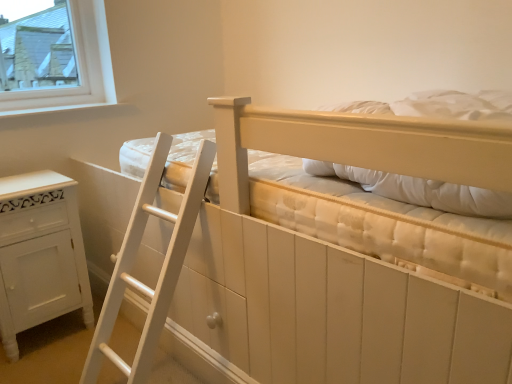
Identify the location of white painted wood cabinet at lower left. This screenshot has width=512, height=384. (40, 254).

This screenshot has width=512, height=384. What do you see at coordinates (393, 221) in the screenshot?
I see `matte white bunk bed at center` at bounding box center [393, 221].

In order to click on white painted wood cabinet at lower left in this screenshot , I will do `click(40, 254)`.

Between matte white bunk bed at center and white wood at upper left, which one has larger size?

matte white bunk bed at center.

From a real-world perspective, between matte white bunk bed at center and white wood at upper left, who is vertically higher?

white wood at upper left.

What's the angular difference between matte white bunk bed at center and white wood at upper left's facing directions?

They differ by 179 degrees in their facing directions.

Based on the photo, from the image's perspective, who appears lower, matte white bunk bed at center or white wood at upper left?

matte white bunk bed at center appears lower in the image.

Looking at this image, which point is more forward, [36,112] or [139,300]?

The point [139,300] is in front.

Is white wood at upper left aimed at white wood drawer at lower center?

No, white wood at upper left is not facing towards white wood drawer at lower center.

Which of these two, white wood at upper left or white wood drawer at lower center, stands shorter?

With less height is white wood at upper left.

Does white wood at upper left have a greater width compared to white wood drawer at lower center?

Indeed, white wood at upper left has a greater width compared to white wood drawer at lower center.

Is white wood at upper left facing towards matte white bunk bed at center?

Yes, white wood at upper left faces towards matte white bunk bed at center.

Does point (3, 114) lie behind point (300, 229)?

Yes.

From a real-world perspective, is white wood at upper left physically located above or below matte white bunk bed at center?

Clearly, from a real-world perspective, white wood at upper left is above matte white bunk bed at center.

Identify the location of window sill above the matte white bunk bed at center (from a real-world perspective). (54, 109).

From a real-world perspective, does white quilted pillow at upper right stand above white wood at upper left?

No, from a real-world perspective, white quilted pillow at upper right is not above white wood at upper left.

Considering the relative sizes of white quilted pillow at upper right and white wood at upper left in the image provided, is white quilted pillow at upper right bigger than white wood at upper left?

Correct, white quilted pillow at upper right is larger in size than white wood at upper left.

From the picture: Can we say white quilted pillow at upper right lies outside white wood at upper left?

A: white quilted pillow at upper right lies outside white wood at upper left's area.

Considering the relative positions of white quilted pillow at upper right and white wood at upper left in the image provided, is white quilted pillow at upper right to the left or to the right of white wood at upper left?

From the image, it's evident that white quilted pillow at upper right is to the right of white wood at upper left.

Is white quilted pillow at upper right turned away from white painted wood cabinet at lower left?

white quilted pillow at upper right does not have its back to white painted wood cabinet at lower left.

Between white quilted pillow at upper right and white painted wood cabinet at lower left, which one has less height?

With less height is white quilted pillow at upper right.

Is white quilted pillow at upper right wider or thinner than white painted wood cabinet at lower left?

Clearly, white quilted pillow at upper right has more width compared to white painted wood cabinet at lower left.

Does matte white bunk bed at center contain white quilted pillow at upper right?

Yes, white quilted pillow at upper right is a part of matte white bunk bed at center.

From the image's perspective, is matte white bunk bed at center above white quilted pillow at upper right?

Incorrect, from the image's perspective, matte white bunk bed at center is lower than white quilted pillow at upper right.

Which of these two, matte white bunk bed at center or white quilted pillow at upper right, stands shorter?

white quilted pillow at upper right is shorter.

Considering the relative sizes of matte white bunk bed at center and white quilted pillow at upper right in the image provided, is matte white bunk bed at center smaller than white quilted pillow at upper right?

No.

Consider the image. From a real-world perspective, relative to white painted wood cabinet at lower left, is white wood drawer at lower center vertically above or below?

white wood drawer at lower center is situated lower than white painted wood cabinet at lower left in the real world.

Considering the sizes of objects white wood drawer at lower center and white painted wood cabinet at lower left in the image provided, who is wider, white wood drawer at lower center or white painted wood cabinet at lower left?

With larger width is white painted wood cabinet at lower left.

Measure the distance between white wood drawer at lower center and white painted wood cabinet at lower left.

white wood drawer at lower center and white painted wood cabinet at lower left are 22.88 inches apart from each other.

Is point (199, 287) closer or farther from the camera than point (61, 187)?

Clearly, point (199, 287) is closer to the camera than point (61, 187).

What are the coordinates of `bed located underneath the white wood at upper left (from a real-world perspective)` in the screenshot? It's located at (393, 221).

The image size is (512, 384). I want to click on drawer lying in front of the white wood at upper left, so click(x=211, y=320).

Based on their spatial positions, is white wood at upper left or white wood drawer at lower center further from white quilted pillow at upper right?

white wood at upper left is positioned further to the anchor white quilted pillow at upper right.

Estimate the real-world distances between objects in this image. Which object is closer to white wood at upper left, matte white bunk bed at center or white wood drawer at lower center?

Among the two, matte white bunk bed at center is located nearer to white wood at upper left.

Considering their positions, is white painted wood cabinet at lower left positioned further to white quilted pillow at upper right than white wood drawer at lower center?

white painted wood cabinet at lower left lies further to white quilted pillow at upper right than the other object.

From the image, which object appears to be nearer to white painted wood cabinet at lower left, white quilted pillow at upper right or white wood at upper left?

The object closer to white painted wood cabinet at lower left is white wood at upper left.

Considering their positions, is white painted wood cabinet at lower left positioned further to white wood drawer at lower center than white wood at upper left?

white wood at upper left lies further to white wood drawer at lower center than the other object.

From the image, which object appears to be farther from white quilted pillow at upper right, white wood at upper left or white painted wood cabinet at lower left?

The object further to white quilted pillow at upper right is white wood at upper left.

Based on their spatial positions, is white wood drawer at lower center or matte white bunk bed at center closer to white painted wood cabinet at lower left?

The object closer to white painted wood cabinet at lower left is white wood drawer at lower center.

Considering their positions, is white quilted pillow at upper right positioned closer to white painted wood cabinet at lower left than matte white bunk bed at center?

matte white bunk bed at center is closer to white painted wood cabinet at lower left.

This screenshot has width=512, height=384. I want to click on window sill located between white painted wood cabinet at lower left and white quilted pillow at upper right in the left-right direction, so click(x=54, y=109).

At what (x,y) coordinates should I click in order to perform the action: click on bed between white wood at upper left and white quilted pillow at upper right in the horizontal direction. Please return your answer as a coordinate pair (x, y). Image resolution: width=512 pixels, height=384 pixels. Looking at the image, I should click on (393, 221).

Locate an element on the screen. The height and width of the screenshot is (384, 512). bed located between white painted wood cabinet at lower left and white quilted pillow at upper right in the left-right direction is located at coordinates (393, 221).

Find the location of a particular element. The image size is (512, 384). furniture between matte white bunk bed at center and white wood at upper left in the front-back direction is located at coordinates (40, 254).